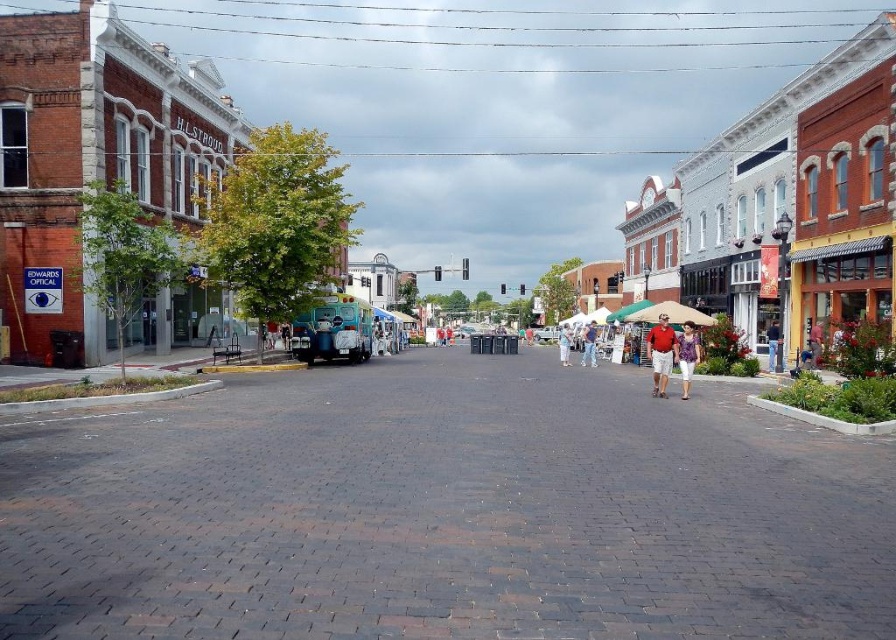
Is dark brick pavement at center further to camera compared to matte blue truck at center?

No.

Is dark brick pavement at center below matte blue truck at center?

Yes, dark brick pavement at center is below matte blue truck at center.

This screenshot has width=896, height=640. Find the location of `dark brick pavement at center`. dark brick pavement at center is located at coordinates (444, 512).

Can you confirm if matte red shirt at center is positioned to the right of matte khaki shorts at center?

No, matte red shirt at center is not to the right of matte khaki shorts at center.

Which is in front, point (656, 362) or point (582, 342)?

Point (656, 362) is in front.

This screenshot has height=640, width=896. I want to click on matte red shirt at center, so click(x=661, y=353).

Is matte khaki shorts at center in front of light blue denim shorts at center?

Yes.

Does matte khaki shorts at center have a lesser width compared to light blue denim shorts at center?

Correct, matte khaki shorts at center's width is less than light blue denim shorts at center's.

This screenshot has height=640, width=896. I want to click on matte khaki shorts at center, so click(589, 344).

What are the coordinates of `matte khaki shorts at center` in the screenshot? It's located at (589, 344).